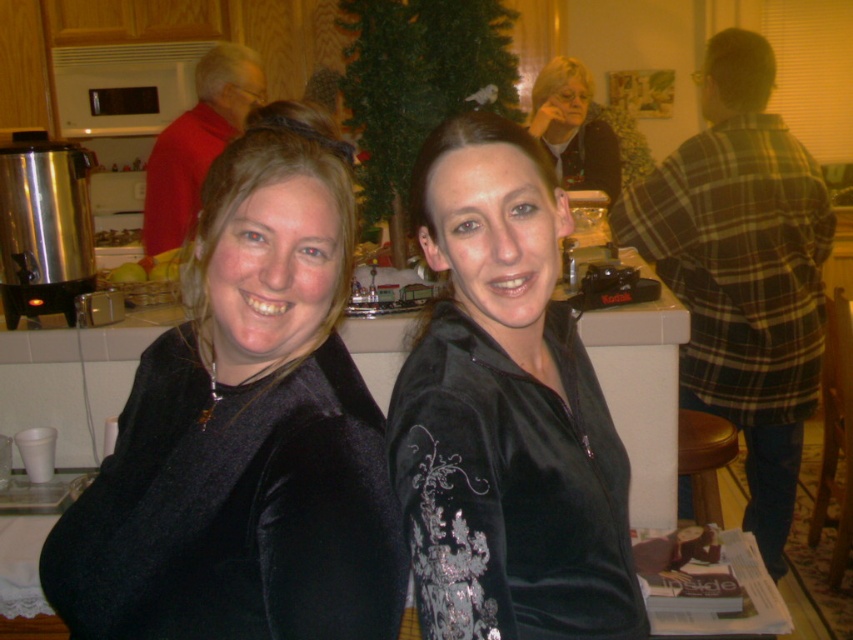
Question: Which point appears closest to the camera in this image?

Choices:
 (A) (717, 426)
 (B) (573, 116)
 (C) (552, 198)

Answer: (C)

Question: Is plaid flannel shirt at right above brown leather stool at lower right?

Choices:
 (A) no
 (B) yes

Answer: (B)

Question: Is velvet black jacket at center above plaid flannel shirt at right?

Choices:
 (A) yes
 (B) no

Answer: (B)

Question: Which object is farther from the camera taking this photo?

Choices:
 (A) matte black jacket at upper center
 (B) velvet black jacket at left
 (C) brown leather stool at lower right
 (D) yellow matte apples at left

Answer: (D)

Question: Which object is the farthest from the yellow matte apples at left?

Choices:
 (A) velvet black jacket at center
 (B) brown leather stool at lower right
 (C) velvet black jacket at left
 (D) plaid flannel shirt at right

Answer: (A)

Question: Observing the image, what is the correct spatial positioning of plaid flannel shirt at right in reference to brown leather stool at lower right?

Choices:
 (A) above
 (B) below

Answer: (A)